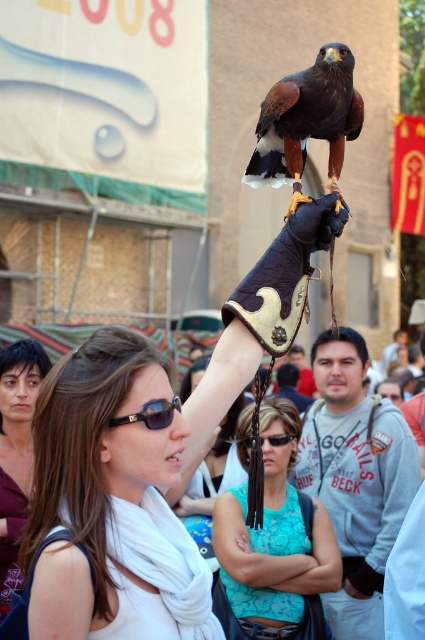
Question: Estimate the real-world distances between objects in this image. Which object is closer to the black plastic sunglasses at upper center?

Choices:
 (A) brown feathered falcon at center
 (B) black leather goggles at upper center

Answer: (A)

Question: Can you confirm if white fabric scarf at center is wider than matte burgundy blouse at left?

Choices:
 (A) no
 (B) yes

Answer: (A)

Question: Estimate the real-world distances between objects in this image. Which object is closer to the matte burgundy blouse at left?

Choices:
 (A) brown feathered falcon at center
 (B) matte teal tank top at center
 (C) white fabric scarf at center

Answer: (B)

Question: Does black plastic sunglasses at upper center have a smaller size compared to black leather goggles at upper center?

Choices:
 (A) no
 (B) yes

Answer: (A)

Question: Does white fabric scarf at center appear under matte burgundy blouse at left?

Choices:
 (A) yes
 (B) no

Answer: (B)

Question: Based on their relative distances, which object is nearer to the brown feathered falcon at center?

Choices:
 (A) matte burgundy blouse at left
 (B) matte teal tank top at center
 (C) black plastic sunglasses at upper center

Answer: (C)